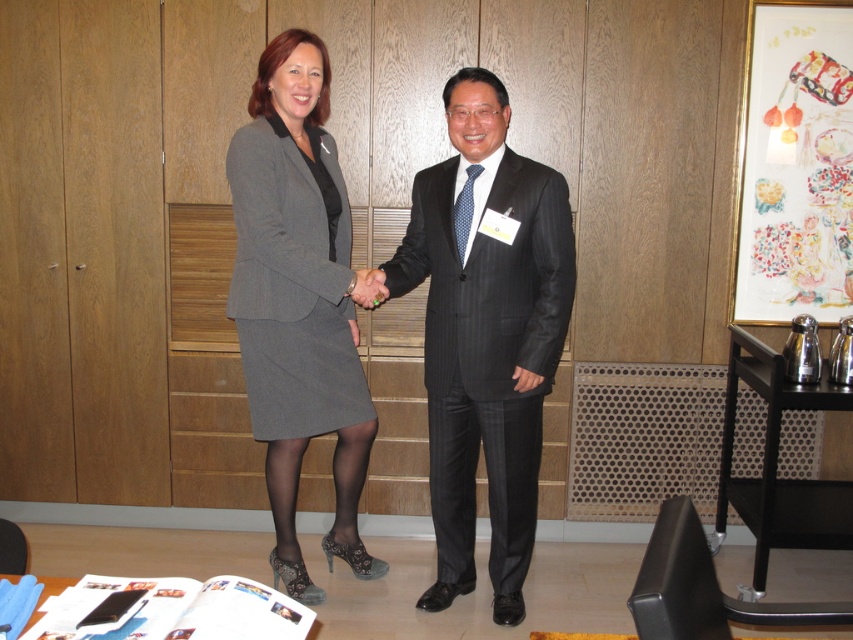
You are a photographer taking a picture of the scene. You notice the gray wool skirt at center and the matte black hand at center. Which object is positioned closer to the camera?

The gray wool skirt at center is closer to the viewer than the matte black hand at center, so the gray wool skirt at center would appear closer to the camera.